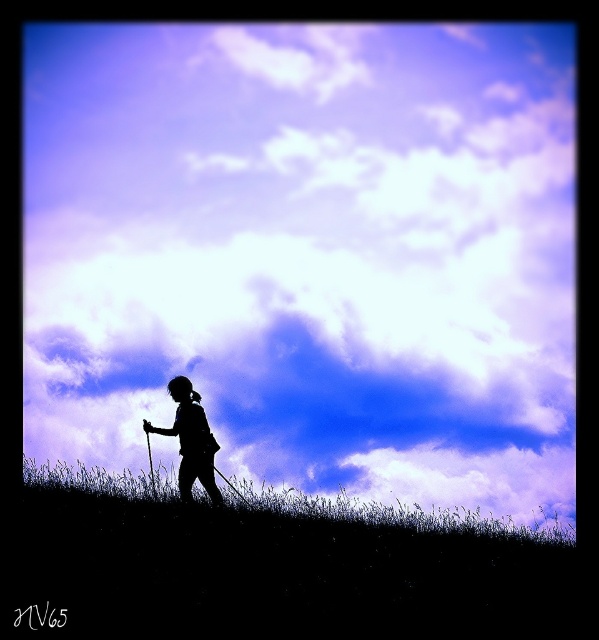
Is black grass at center smaller than green grassy at lower center?

Actually, black grass at center might be larger than green grassy at lower center.

What do you see at coordinates (271, 572) in the screenshot? The image size is (599, 640). I see `black grass at center` at bounding box center [271, 572].

I want to click on black grass at center, so click(271, 572).

Does point (170, 236) come behind point (562, 545)?

Yes, point (170, 236) is farther from viewer.

Can you confirm if white fluffy cloud at upper center is smaller than green grassy at lower center?

Incorrect, white fluffy cloud at upper center is not smaller in size than green grassy at lower center.

Does point (564, 54) lie in front of point (428, 522)?

No, (564, 54) is behind (428, 522).

Locate an element on the screen. The width and height of the screenshot is (599, 640). white fluffy cloud at upper center is located at coordinates (307, 252).

Who is taller, green grassy at lower center or silhouette figure at center?

Standing taller between the two is silhouette figure at center.

You are a GUI agent. You are given a task and a screenshot of the screen. Output one action in this format:
    pyautogui.click(x=<x>, y=<y>)
    Task: Click on the green grassy at lower center
    This screenshot has width=599, height=640.
    Given the screenshot: What is the action you would take?
    pyautogui.click(x=391, y=513)